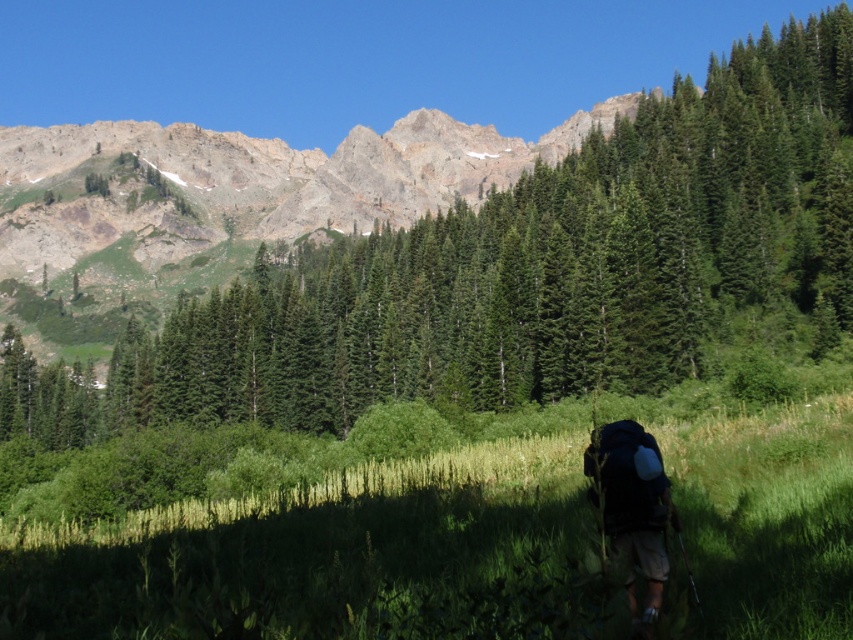
Question: Which object is closer to the camera taking this photo?

Choices:
 (A) dark blue backpack at lower right
 (B) green grassy at lower center

Answer: (B)

Question: Is the position of green grassy at lower center less distant than that of dark blue backpack at lower right?

Choices:
 (A) no
 (B) yes

Answer: (B)

Question: Can you confirm if green grassy at lower center is positioned to the right of dark blue backpack at lower right?

Choices:
 (A) no
 (B) yes

Answer: (A)

Question: Which object appears farthest from the camera in this image?

Choices:
 (A) dark blue backpack at lower right
 (B) green grassy at lower center

Answer: (A)

Question: Can you confirm if green grassy at lower center is positioned above dark blue backpack at lower right?

Choices:
 (A) yes
 (B) no

Answer: (B)